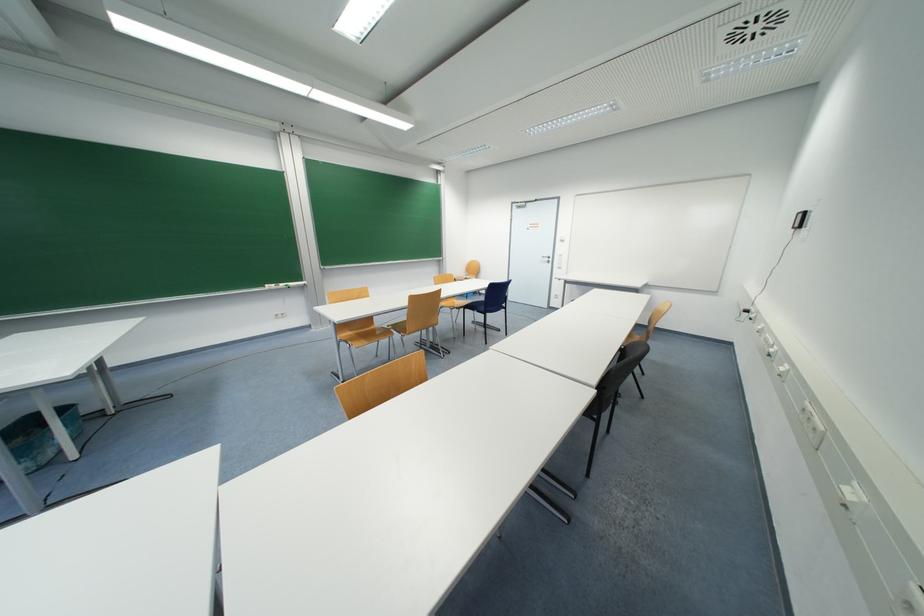
Where is `white electrical plug`? The image size is (924, 616). white electrical plug is located at coordinates (811, 424).